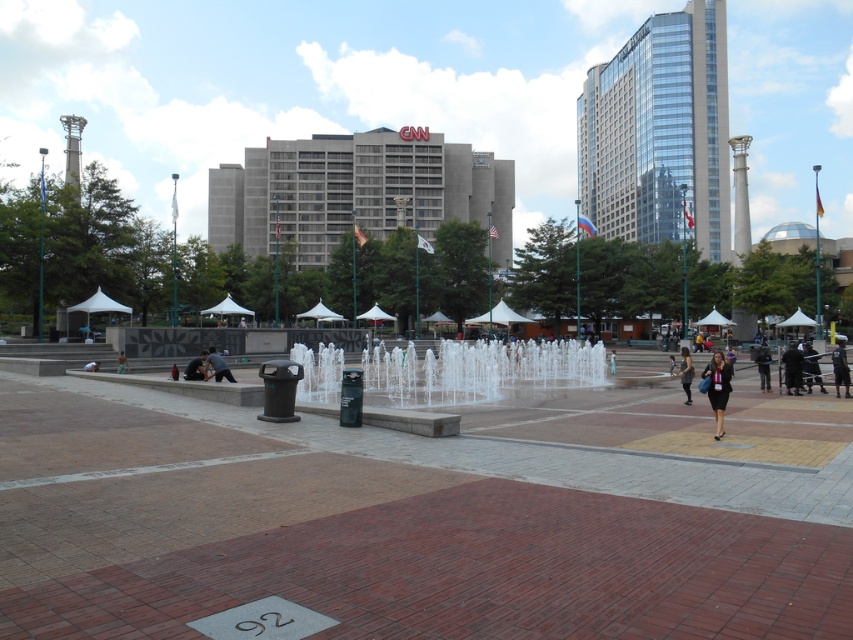
You are a photographer trying to capture both the silver metallic plaque at lower center and the dark gray fabric dress at lower right in a single frame. Based on their sizes, which object should you focus on to ensure both fit in the photo?

Since the silver metallic plaque at lower center occupies less space than the dark gray fabric dress at lower right, you should focus on the dark gray fabric dress at lower right to ensure both fit in the photo.

You are standing at the camera position and want to read the silver metallic plaque at lower center without moving your feet. Can you read the text on it clearly?

The silver metallic plaque at lower center is 13.22 feet away from camera, so you cannot read the text on it clearly without moving closer.

You are standing at the edge of the plaza and want to take a photo of the clear glass water at center. Where should you position yourself to capture it in the frame?

To capture the clear glass water at center in your photo, position yourself at the edge of the plaza facing towards the center point at coordinates approximately (477, 369).